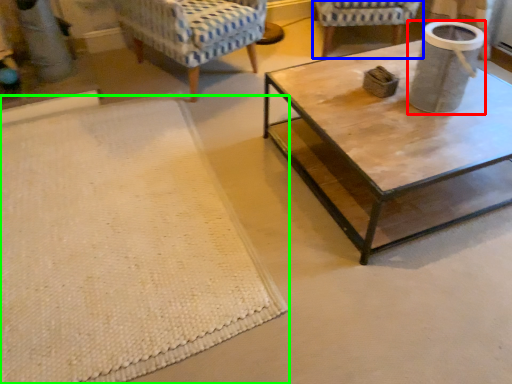
Question: Estimate the real-world distances between objects in this image. Which object is farther from gray (highlighted by a red box), chair (highlighted by a blue box) or mat (highlighted by a green box)?

Choices:
 (A) chair
 (B) mat

Answer: (A)